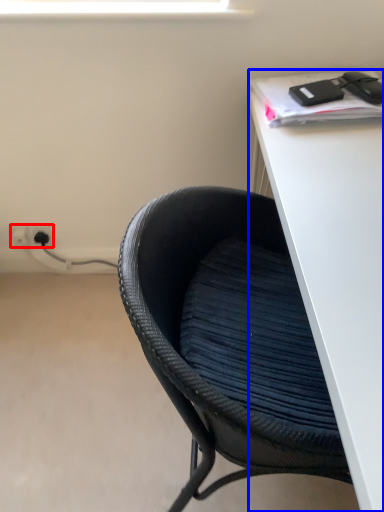
Question: Among these objects, which one is farthest to the camera, electric outlet (highlighted by a red box) or desk (highlighted by a blue box)?

Choices:
 (A) electric outlet
 (B) desk

Answer: (A)